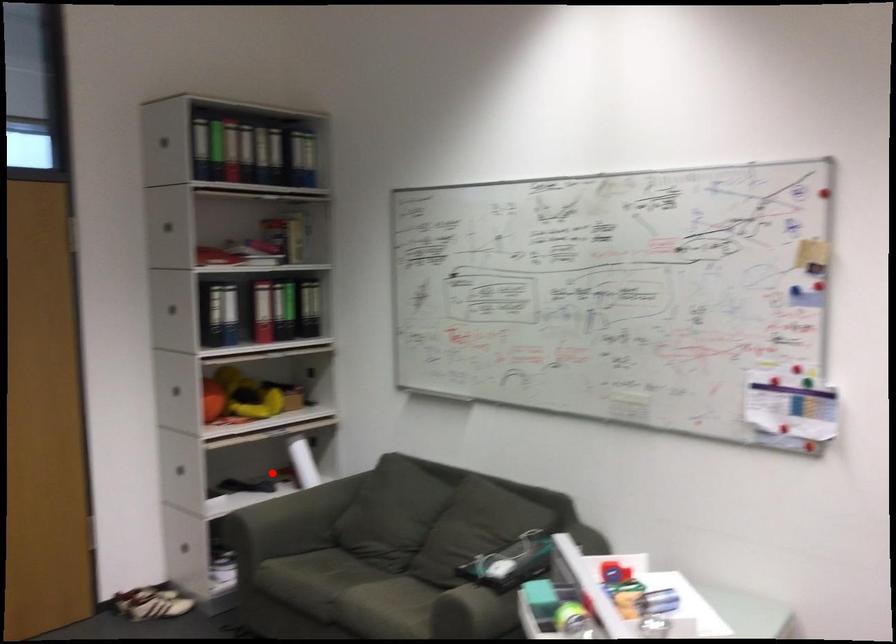
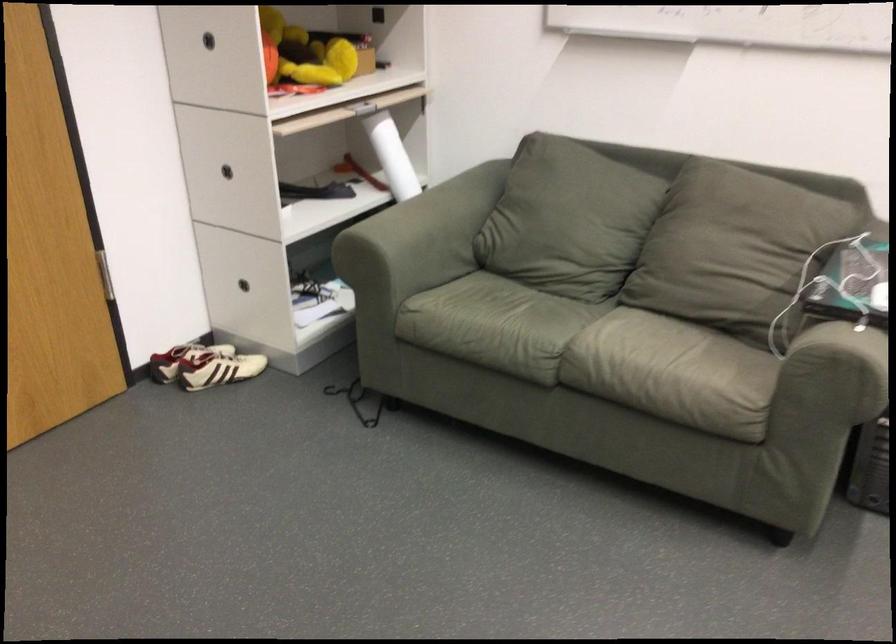
Question: A red point is marked in image1. In image2, is the corresponding 3D point closer to the camera or farther? Reply with the corresponding letter.

Choices:
 (A) The corresponding 3D point is closer.
 (B) The corresponding 3D point is farther.

Answer: (A)